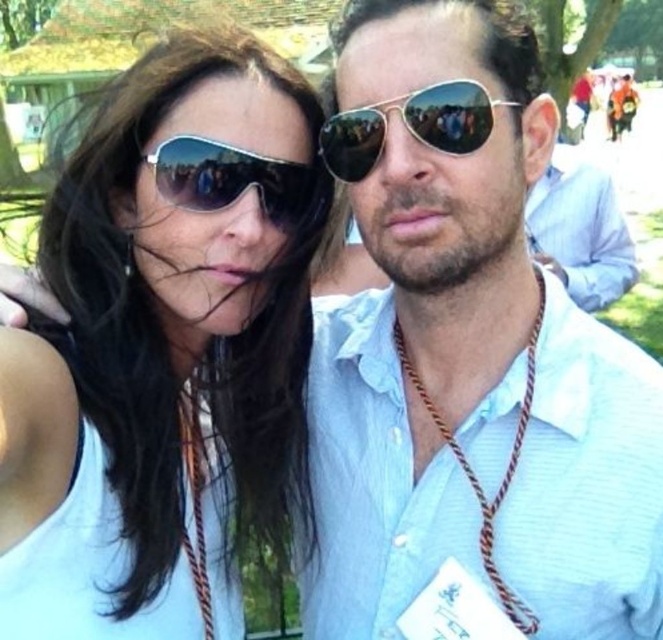
You are a photographer trying to capture a clear shot of both matte black sunglasses at upper left and metal aviator sunglasses at center. Given that your camera can only focus on objects within a 15 cm focal range, will both sunglasses fit within this range if they are positioned side by side?

The matte black sunglasses at upper left is larger in size than the metal aviator sunglasses at center, but the question is about their positions and focal range, not size. Since the exact distance between them isn

You are a photographer trying to capture a closeup of the matte white shirt at center and the metal aviator sunglasses at center. Which object should you zoom in on more to ensure both are in focus?

The matte white shirt at center is bigger than the metal aviator sunglasses at center, so you should zoom in more on the metal aviator sunglasses at center to ensure both are in focus.

You are a photographer trying to focus on the matte white shirt at center in the image. Where exactly should you aim your camera to capture it?

You should aim your camera at point coordinates (467, 364) to capture the matte white shirt at center.